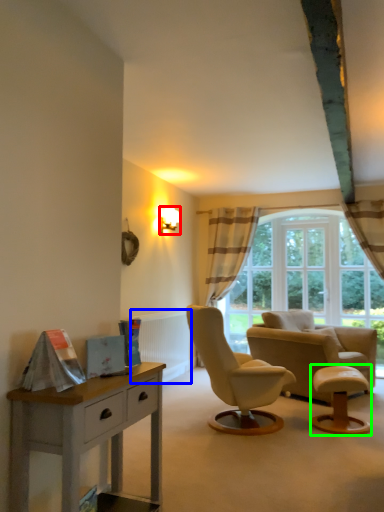
Question: Considering the real-world distances, which object is closest to lamp (highlighted by a red box)? radiator (highlighted by a blue box) or stool (highlighted by a green box).

Choices:
 (A) radiator
 (B) stool

Answer: (A)